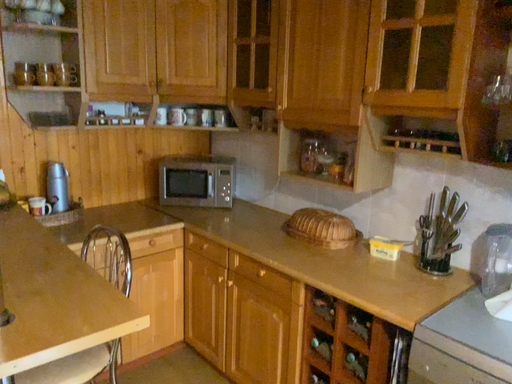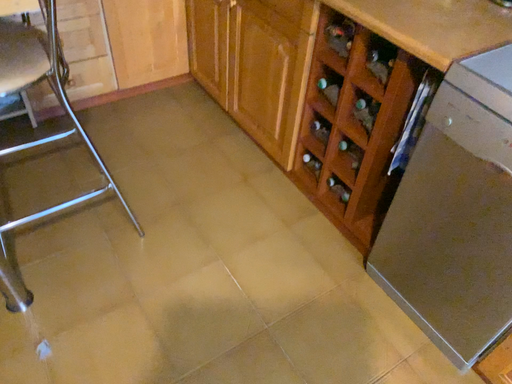
Question: Which way did the camera rotate in the video?

Choices:
 (A) rotated right
 (B) rotated left

Answer: (B)